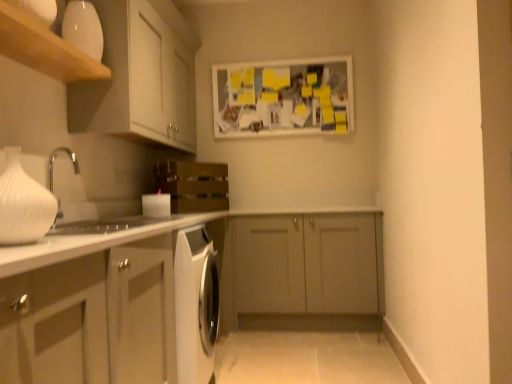
Question: Is white matte cabinet at lower left, positioned as the third cabinetry in top-to-bottom order, looking in the opposite direction of white matte vase at left?

Choices:
 (A) no
 (B) yes

Answer: (A)

Question: Can you confirm if white matte cabinet at lower left, positioned as the third cabinetry in top-to-bottom order, is bigger than white matte vase at left?

Choices:
 (A) yes
 (B) no

Answer: (A)

Question: Is white matte cabinet at lower left, marked as the first cabinetry in a bottom-to-top arrangement, far away from white matte vase at left?

Choices:
 (A) yes
 (B) no

Answer: (B)

Question: Is white matte cabinet at lower left, positioned as the third cabinetry in top-to-bottom order, surrounding white matte vase at left?

Choices:
 (A) no
 (B) yes

Answer: (A)

Question: Considering the relative sizes of white matte cabinet at lower left, positioned as the third cabinetry in top-to-bottom order, and white matte vase at left in the image provided, is white matte cabinet at lower left, positioned as the third cabinetry in top-to-bottom order, shorter than white matte vase at left?

Choices:
 (A) no
 (B) yes

Answer: (A)

Question: From a real-world perspective, is white matte cabinet at lower left, marked as the first cabinetry in a bottom-to-top arrangement, over white matte vase at left?

Choices:
 (A) yes
 (B) no

Answer: (B)

Question: From the image's perspective, is matte gray cabinet at center, acting as the 2th cabinetry starting from the top, under wooden crate at center?

Choices:
 (A) no
 (B) yes

Answer: (B)

Question: Would you say matte gray cabinet at center, which ranks as the second cabinetry in bottom-to-top order, is outside wooden crate at center?

Choices:
 (A) yes
 (B) no

Answer: (A)

Question: Does matte gray cabinet at center, acting as the 2th cabinetry starting from the top, touch wooden crate at center?

Choices:
 (A) no
 (B) yes

Answer: (A)

Question: Considering the relative sizes of matte gray cabinet at center, acting as the 2th cabinetry starting from the top, and wooden crate at center in the image provided, is matte gray cabinet at center, acting as the 2th cabinetry starting from the top, bigger than wooden crate at center?

Choices:
 (A) no
 (B) yes

Answer: (B)

Question: Is matte gray cabinet at center, which ranks as the second cabinetry in bottom-to-top order, facing towards wooden crate at center?

Choices:
 (A) no
 (B) yes

Answer: (A)

Question: Is matte gray cabinet at center, which ranks as the second cabinetry in bottom-to-top order, positioned far away from wooden crate at center?

Choices:
 (A) no
 (B) yes

Answer: (A)

Question: Is matte gray cabinet at center, which ranks as the second cabinetry in bottom-to-top order, facing towards white matte cabinet at upper left, marked as the third cabinetry in a bottom-to-top arrangement?

Choices:
 (A) no
 (B) yes

Answer: (A)